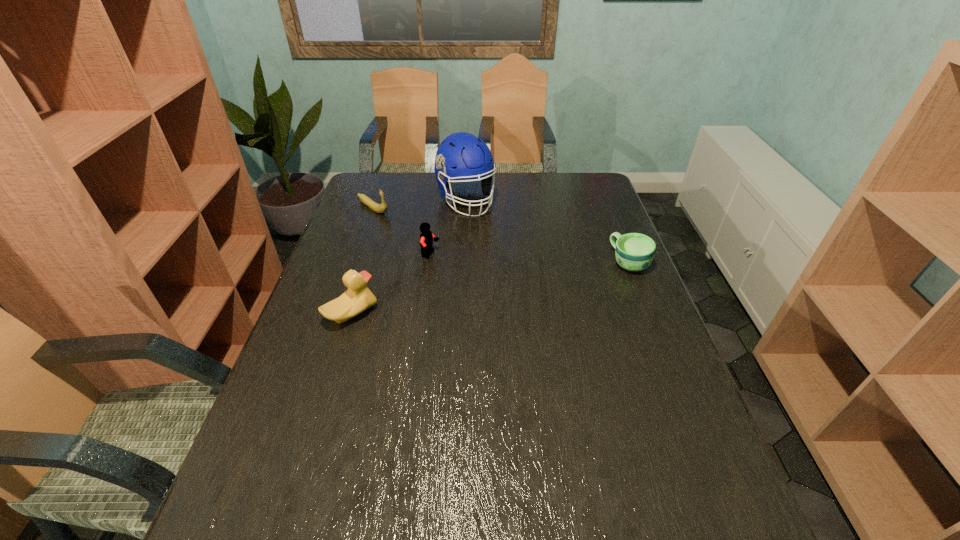
What are the coordinates of `vacant space located at the stem of the banana` in the screenshot? It's located at (395, 221).

The width and height of the screenshot is (960, 540). In order to click on free space located on the front-facing side of the Lego in this screenshot , I will do `click(520, 289)`.

Image resolution: width=960 pixels, height=540 pixels. In order to click on free space located on the front-facing side of the Lego in this screenshot , I will do `click(557, 303)`.

At what (x,y) coordinates should I click in order to perform the action: click on vacant area located 0.120m on the front-facing side of the Lego. Please return your answer as a coordinate pair (x, y). Looking at the image, I should click on (471, 271).

This screenshot has width=960, height=540. What are the coordinates of `free space located on the front-facing side of the football helmet` in the screenshot? It's located at (483, 228).

In order to click on free space located on the front-facing side of the football helmet in this screenshot , I will do `click(492, 239)`.

This screenshot has height=540, width=960. Find the location of `vacant region located on the front-facing side of the football helmet`. vacant region located on the front-facing side of the football helmet is located at coordinates (513, 267).

Identify the location of banana that is positioned at the far edge. (380, 208).

You are a GUI agent. You are given a task and a screenshot of the screen. Output one action in this format:
    pyautogui.click(x=<x>, y=<y>)
    Task: Click on the football helmet at the far edge
    The image size is (960, 540).
    Given the screenshot: What is the action you would take?
    pyautogui.click(x=461, y=155)

Locate an element on the screen. duck that is at the left edge is located at coordinates (358, 298).